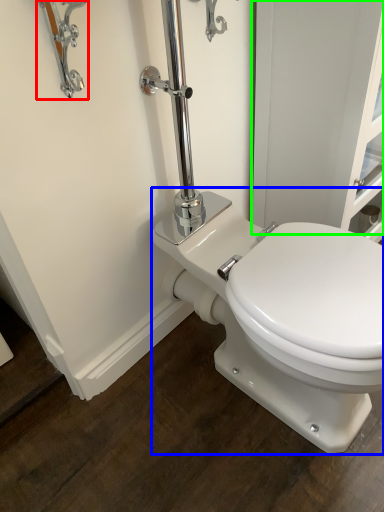
Question: Which is farther away from faucet (highlighted by a red box)? toilet (highlighted by a blue box) or screen door (highlighted by a green box)?

Choices:
 (A) toilet
 (B) screen door

Answer: (A)